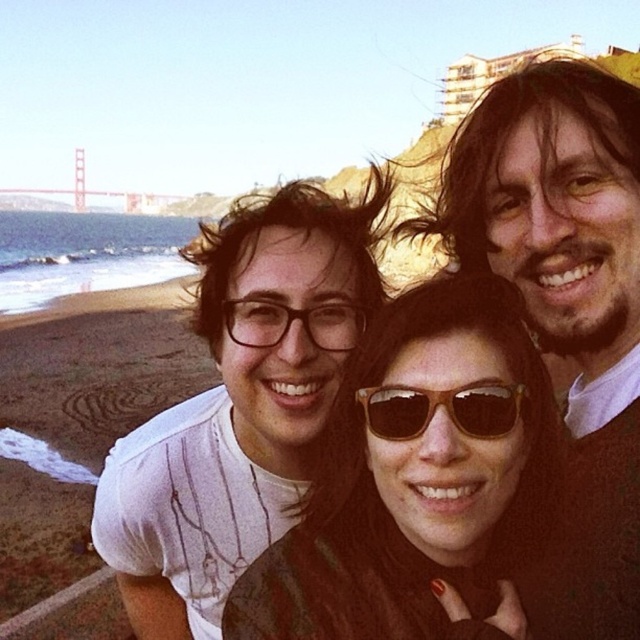
You are a photographer trying to adjust the composition of the image. You want to place the brown leather jacket at center and the brown wooden sunglasses at center so that they are aligned horizontally. Which object should you move to the right to achieve this alignment?

The brown leather jacket at center should be moved to the right to align it horizontally with the brown wooden sunglasses at center since it is currently positioned to the left of the sunglasses.

You are a photographer trying to frame a shot of the three people. The brown leather jacket at center and brown wooden sunglasses at center are both in focus. Which object takes up more horizontal space in the photo?

The brown leather jacket at center takes up more horizontal space in the photo because its width surpasses that of the brown wooden sunglasses at center.